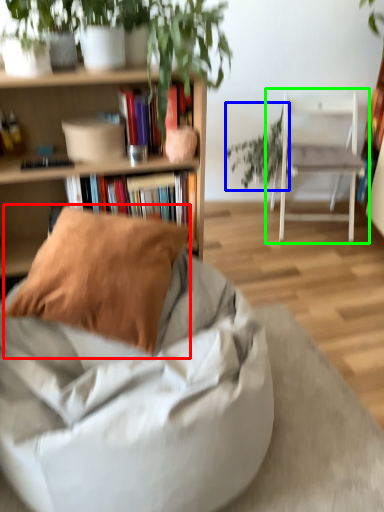
Question: Which object is the farthest from pillow (highlighted by a red box)? Choose among these: vegetation (highlighted by a blue box) or chair (highlighted by a green box).

Choices:
 (A) vegetation
 (B) chair

Answer: (A)